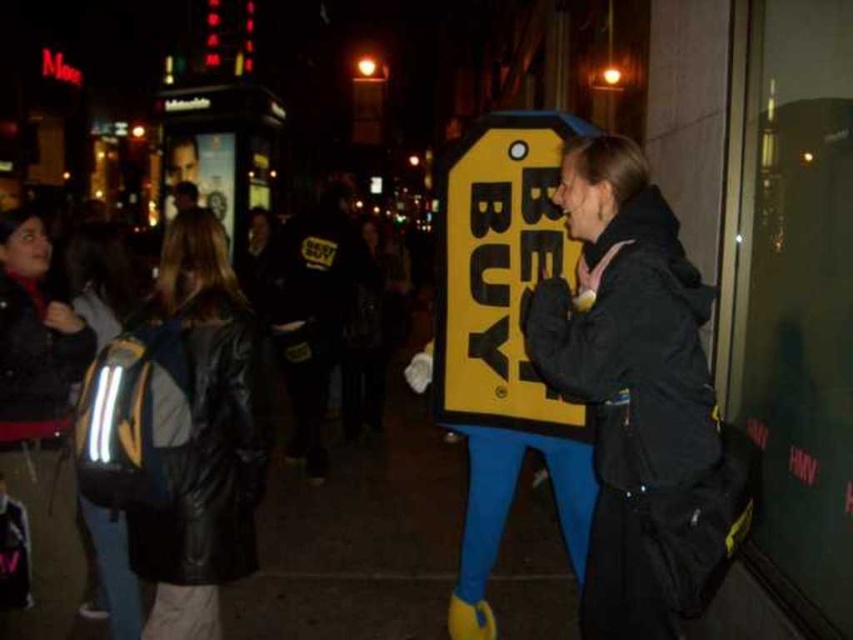
You are a photographer trying to capture the black matte jacket at center in the image. What are the exact coordinates where you should focus your camera to ensure the jacket is centered in the frame?

The exact coordinates for the black matte jacket at center are point (627, 376).

What are the coordinates of the yellow cardboard sign at center?

The yellow cardboard sign at center is located at point (498, 272).